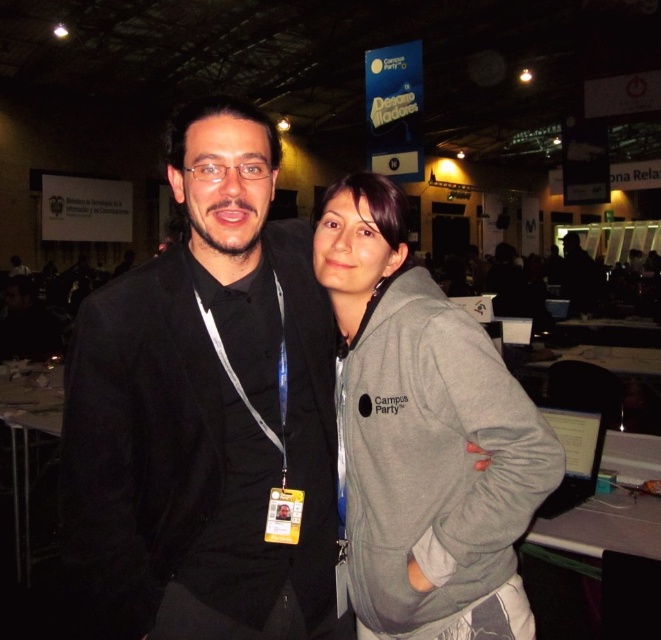
Question: Is black matte suit at center smaller than gray fleece jacket at center?

Choices:
 (A) yes
 (B) no

Answer: (B)

Question: Is black matte suit at center bigger than gray fleece jacket at center?

Choices:
 (A) yes
 (B) no

Answer: (A)

Question: Which of the following is the farthest from the observer?

Choices:
 (A) (319, 237)
 (B) (214, 232)

Answer: (A)

Question: Does black matte suit at center appear under gray fleece jacket at center?

Choices:
 (A) no
 (B) yes

Answer: (A)